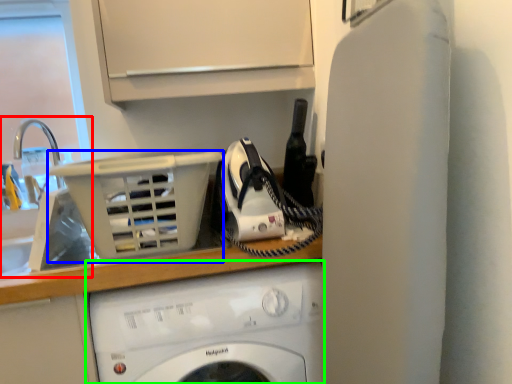
Question: Considering the real-world distances, which object is farthest from sink (highlighted by a red box)? basket (highlighted by a blue box) or washing machine (highlighted by a green box)?

Choices:
 (A) basket
 (B) washing machine

Answer: (B)